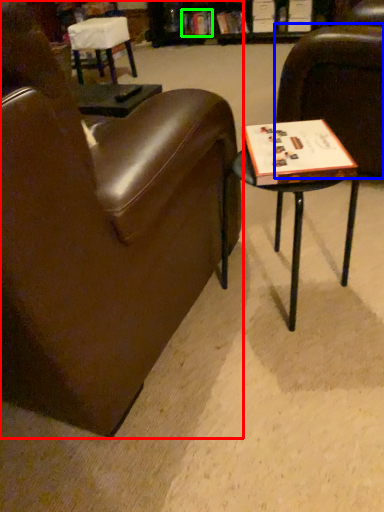
Question: Based on their relative distances, which object is nearer to chair (highlighted by a red box)? Choose from chair (highlighted by a blue box) and book (highlighted by a green box).

Choices:
 (A) chair
 (B) book

Answer: (A)